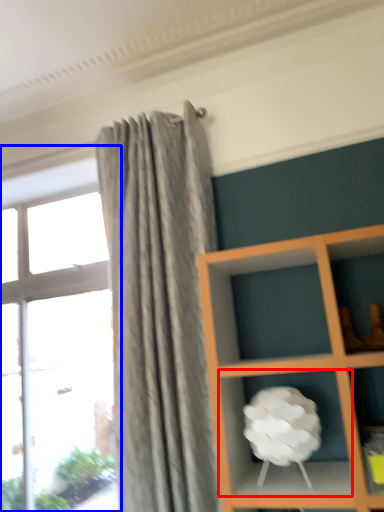
Question: Which of the following is the closest to the observer, cabinet (highlighted by a red box) or window (highlighted by a blue box)?

Choices:
 (A) cabinet
 (B) window

Answer: (A)